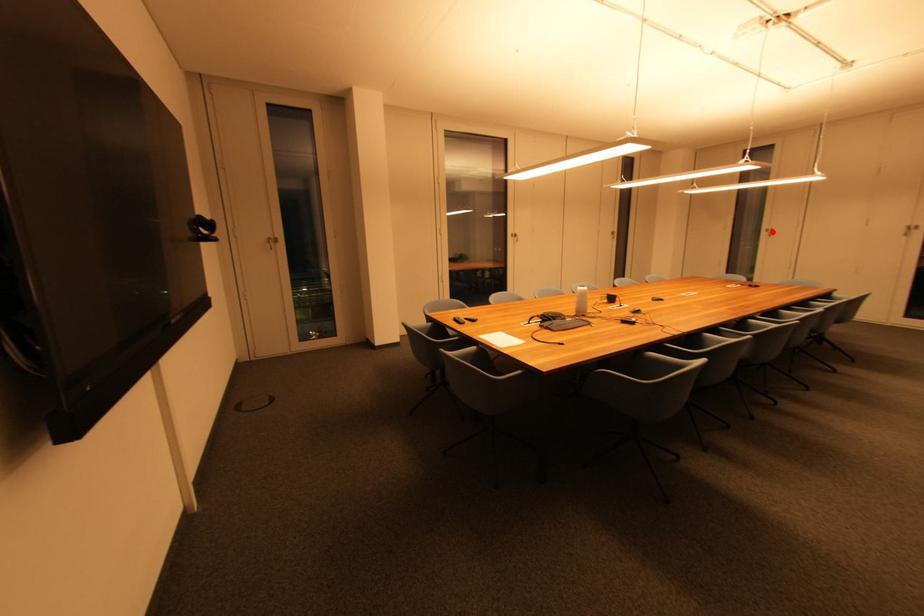
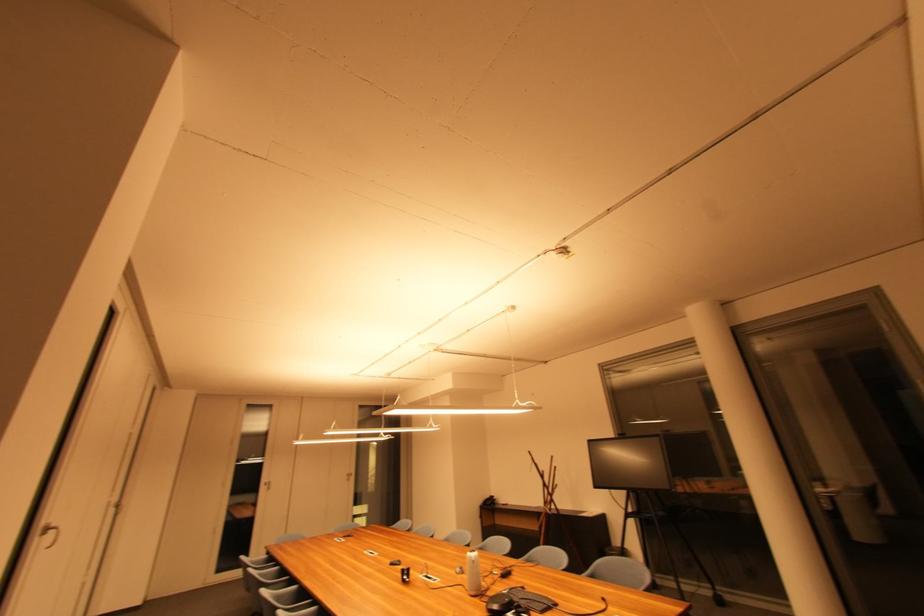
Where in the second image is the point corresponding to the highlighted location from the first image?

(271, 485)